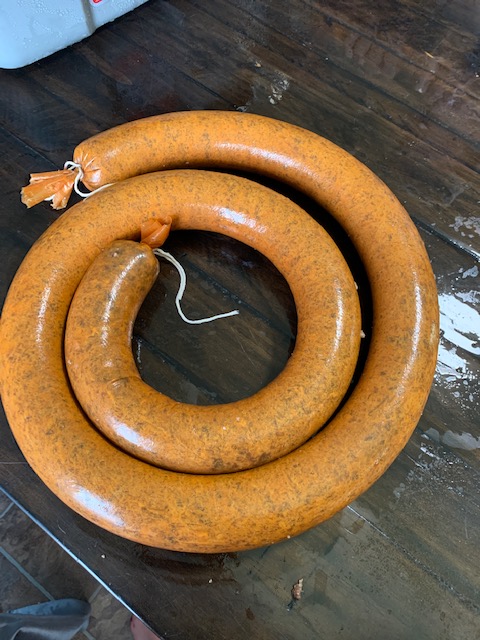
Locate an element on the screen. Image resolution: width=480 pixels, height=640 pixels. grout is located at coordinates (38, 589), (32, 577).